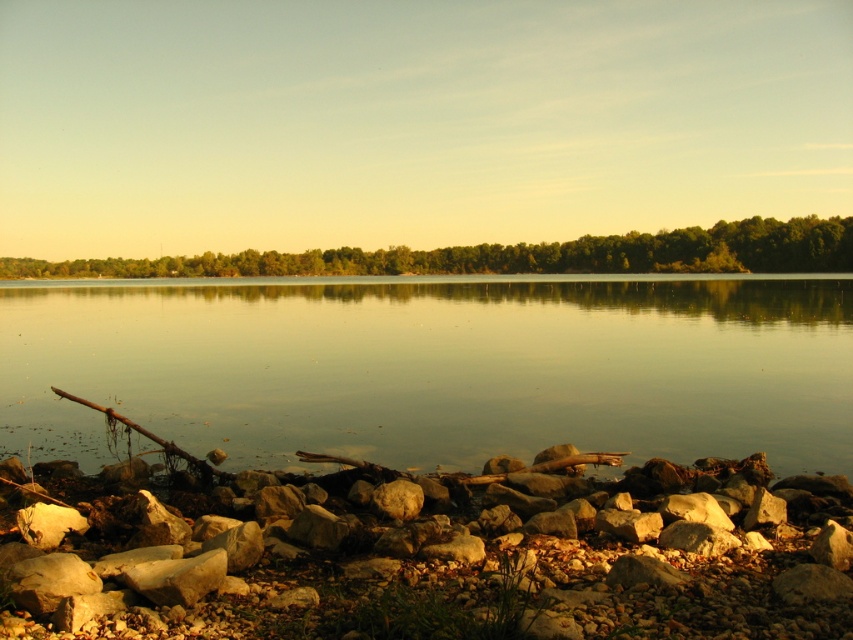
Is smooth gray rock at lower center thinner than green leafy trees at center?

Indeed, smooth gray rock at lower center has a lesser width compared to green leafy trees at center.

In the scene shown: Who is positioned more to the left, smooth gray rock at lower center or green leafy trees at center?

Positioned to the left is green leafy trees at center.

Between point (39, 544) and point (752, 268), which one is positioned behind?

Positioned behind is point (752, 268).

Identify the location of smooth gray rock at lower center. (437, 566).

Which is behind, point (343, 332) or point (751, 259)?

Positioned behind is point (751, 259).

From the picture: Can you confirm if clear water at center is bigger than green leafy trees at center?

No.

Between point (544, 346) and point (62, 260), which one is positioned behind?

Positioned behind is point (62, 260).

Identify the location of clear water at center. click(x=437, y=369).

Who is more distant from viewer, (660, 282) or (830, 548)?

Point (660, 282)

Does point (421, 381) come behind point (358, 536)?

That is True.

Is point (296, 342) positioned in front of point (715, 554)?

No.

Find the location of a particular element. clear water at center is located at coordinates (437, 369).